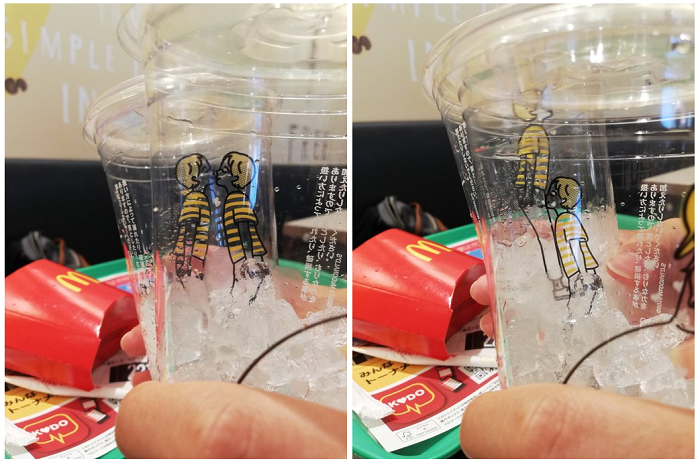
The height and width of the screenshot is (463, 700). Identify the location of plastic cup. (134, 181), (197, 201), (519, 196), (638, 217).